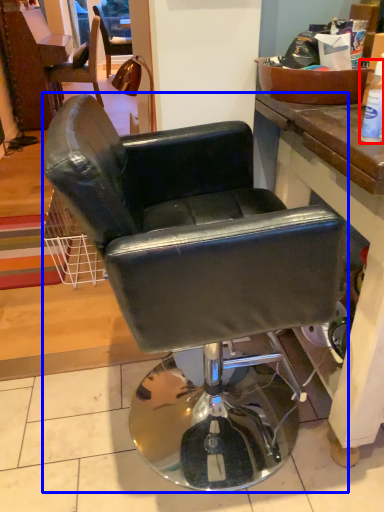
Question: Which of the following is the closest to the observer, bottle (highlighted by a red box) or chair (highlighted by a blue box)?

Choices:
 (A) bottle
 (B) chair

Answer: (B)